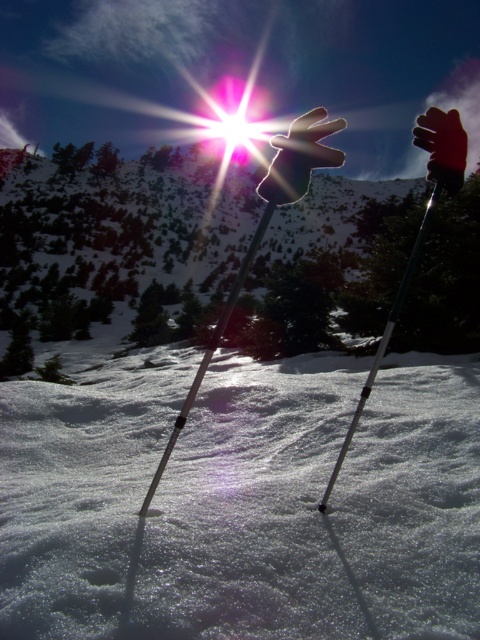
Who is more forward, (296, 218) or (387, 340)?

Positioned in front is point (387, 340).

At what (x,y) coordinates should I click in order to perform the action: click on white snow at center. Please return your answer as a coordinate pair (x, y). This screenshot has width=480, height=640. Looking at the image, I should click on (86, 232).

Which is above, white snow at center or red matte glove at upper right?

red matte glove at upper right

Is white snow at center smaller than red matte glove at upper right?

Yes.

Find the location of `white snow at center`. white snow at center is located at coordinates (86, 232).

Consider the image. Can you confirm if white powdery snow at center is taller than white matte glove at center?

No.

Based on the photo, does white powdery snow at center have a smaller size compared to white matte glove at center?

Correct, white powdery snow at center occupies less space than white matte glove at center.

Is point (468, 380) farther from camera compared to point (294, 140)?

Yes, point (468, 380) is behind point (294, 140).

Locate an element on the screen. The image size is (480, 640). white powdery snow at center is located at coordinates (242, 500).